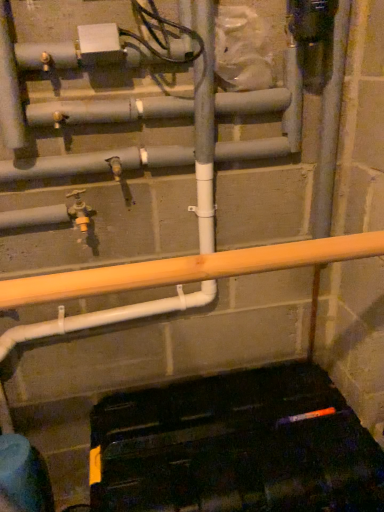
What do you see at coordinates (188, 269) in the screenshot? I see `orange wood beam at center` at bounding box center [188, 269].

In order to face matte yellow valve at center-left, should I rotate leftwards or rightwards?

You should rotate left by 14.425 degrees.

I want to click on gray matte pipe at center, acting as the 1th pipe starting from the bottom, so click(98, 162).

Is matte yellow valve at center-left to the left or to the right of orange wood beam at center in the image?

Clearly, matte yellow valve at center-left is on the left of orange wood beam at center in the image.

Which of these two, matte yellow valve at center-left or orange wood beam at center, is smaller?

Smaller between the two is matte yellow valve at center-left.

From a real-world perspective, is matte yellow valve at center-left below orange wood beam at center?

No, from a real-world perspective, matte yellow valve at center-left is not below orange wood beam at center.

Based on their positions, is orange wood beam at center located to the left or right of gray matte pipe at center?

orange wood beam at center is to the right of gray matte pipe at center.

Is gray matte pipe at center at the back of orange wood beam at center?

No, orange wood beam at center is not facing the opposite direction of gray matte pipe at center.

Based on the photo, is the depth of orange wood beam at center less than that of gray matte pipe at center?

Yes, the depth of orange wood beam at center is less than that of gray matte pipe at center.

Considering the relative sizes of orange wood beam at center and gray matte pipe at center, acting as the second pipe starting from the top, in the image provided, is orange wood beam at center taller than gray matte pipe at center, acting as the second pipe starting from the top,?

No.

Is orange wood beam at center wider or thinner than gray matte pipe at center, acting as the 1th pipe starting from the bottom?

orange wood beam at center is wider than gray matte pipe at center, acting as the 1th pipe starting from the bottom.

Does orange wood beam at center have a smaller size compared to gray matte pipe at center, acting as the second pipe starting from the top?

No, orange wood beam at center is not smaller than gray matte pipe at center, acting as the second pipe starting from the top.

From the image's perspective, is orange wood beam at center beneath gray matte pipe at center, acting as the 1th pipe starting from the bottom?

Correct, orange wood beam at center appears lower than gray matte pipe at center, acting as the 1th pipe starting from the bottom, in the image.

Which is closer to the camera, (200, 231) or (9, 168)?

Point (9, 168)

Which is more to the left, gray matte pipe at center or gray matte pipe at center, acting as the second pipe starting from the top?

gray matte pipe at center, acting as the second pipe starting from the top, is more to the left.

How different are the orientations of gray matte pipe at center and gray matte pipe at center, acting as the second pipe starting from the top, in degrees?

The angle between the facing direction of gray matte pipe at center and the facing direction of gray matte pipe at center, acting as the second pipe starting from the top, is 0.036 degrees.

Considering their positions, is gray matte pipe at center located in front of or behind gray matte pipe at center, acting as the second pipe starting from the top?

Visually, gray matte pipe at center is located in front of gray matte pipe at center, acting as the second pipe starting from the top.

What's the angular difference between orange wood beam at center and matte gray pipe at upper center, arranged as the 1th pipe when viewed from the top,'s facing directions?

There is a 0.981-degree angle between the facing directions of orange wood beam at center and matte gray pipe at upper center, arranged as the 1th pipe when viewed from the top.

Can you see orange wood beam at center touching matte gray pipe at upper center, arranged as the 1th pipe when viewed from the top?

orange wood beam at center and matte gray pipe at upper center, arranged as the 1th pipe when viewed from the top, are not in contact.

Can you confirm if orange wood beam at center is positioned to the left of matte gray pipe at upper center, the 2th pipe when ordered from bottom to top?

No, orange wood beam at center is not to the left of matte gray pipe at upper center, the 2th pipe when ordered from bottom to top.

Locate an element on the screen. beam directly beneath the matte gray pipe at upper center, the 2th pipe when ordered from bottom to top (from a real-world perspective) is located at coordinates (188, 269).

Between gray matte pipe at center, acting as the 1th pipe starting from the bottom, and orange wood beam at center, which one appears on the right side from the viewer's perspective?

orange wood beam at center is more to the right.

You are a GUI agent. You are given a task and a screenshot of the screen. Output one action in this format:
    pyautogui.click(x=<x>, y=<y>)
    Task: Click on the 2nd pipe behind the orange wood beam at center, counting from the anchor's position
    
    Given the screenshot: What is the action you would take?
    pyautogui.click(x=98, y=162)

Considering the points (101, 164) and (353, 236), which point is in front, point (101, 164) or point (353, 236)?

The point (353, 236) is closer.

Considering the points (102, 164) and (78, 216), which point is behind, point (102, 164) or point (78, 216)?

The point (78, 216) is farther from the camera.

Which object is positioned more to the right, gray matte pipe at center, acting as the second pipe starting from the top, or matte yellow valve at center-left?

Positioned to the right is gray matte pipe at center, acting as the second pipe starting from the top.

This screenshot has height=512, width=384. I want to click on plumbing fixture on the left of gray matte pipe at center, acting as the 1th pipe starting from the bottom, so click(79, 210).

Are gray matte pipe at center, acting as the second pipe starting from the top, and matte yellow valve at center-left making contact?

No, gray matte pipe at center, acting as the second pipe starting from the top, is not in contact with matte yellow valve at center-left.

I want to click on beam in front of the matte yellow valve at center-left, so click(x=188, y=269).

Where is `pole above the orange wood beam at center (from the image's perspective)`? pole above the orange wood beam at center (from the image's perspective) is located at coordinates (205, 125).

From the picture: Estimate the real-world distances between objects in this image. Which object is closer to gray matte pipe at center, acting as the second pipe starting from the top, orange wood beam at center or matte yellow valve at center-left?

matte yellow valve at center-left lies closer to gray matte pipe at center, acting as the second pipe starting from the top, than the other object.

From the image, which object appears to be nearer to orange wood beam at center, gray matte pipe at center, acting as the 1th pipe starting from the bottom, or matte yellow valve at center-left?

gray matte pipe at center, acting as the 1th pipe starting from the bottom, lies closer to orange wood beam at center than the other object.

Which object lies further to the anchor point matte yellow valve at center-left, gray matte pipe at center, acting as the 1th pipe starting from the bottom, or matte gray pipe at upper center, arranged as the 1th pipe when viewed from the top?

matte gray pipe at upper center, arranged as the 1th pipe when viewed from the top, lies further to matte yellow valve at center-left than the other object.

Looking at this image, when comparing their distances from gray matte pipe at center, acting as the second pipe starting from the top, does matte gray pipe at upper center, the 2th pipe when ordered from bottom to top, or gray matte pipe at center seem closer?

matte gray pipe at upper center, the 2th pipe when ordered from bottom to top, lies closer to gray matte pipe at center, acting as the second pipe starting from the top, than the other object.

Considering their positions, is gray matte pipe at center positioned closer to matte gray pipe at upper center, arranged as the 1th pipe when viewed from the top, than gray matte pipe at center, acting as the second pipe starting from the top?

gray matte pipe at center, acting as the second pipe starting from the top, lies closer to matte gray pipe at upper center, arranged as the 1th pipe when viewed from the top, than the other object.

Based on the photo, when comparing their distances from matte gray pipe at upper center, arranged as the 1th pipe when viewed from the top, does orange wood beam at center or gray matte pipe at center, acting as the second pipe starting from the top, seem further?

The object further to matte gray pipe at upper center, arranged as the 1th pipe when viewed from the top, is orange wood beam at center.

Looking at this image, from the image, which object appears to be farther from gray matte pipe at center, acting as the second pipe starting from the top, matte yellow valve at center-left or gray matte pipe at center?

matte yellow valve at center-left is further to gray matte pipe at center, acting as the second pipe starting from the top.

From the image, which object appears to be nearer to matte yellow valve at center-left, gray matte pipe at center or orange wood beam at center?

Based on the image, gray matte pipe at center appears to be nearer to matte yellow valve at center-left.

Locate an element on the screen. pipe between matte gray pipe at upper center, arranged as the 1th pipe when viewed from the top, and gray matte pipe at center vertically is located at coordinates (98, 162).

Where is `pipe between orange wood beam at center and gray matte pipe at center, acting as the second pipe starting from the top, from front to back`? This screenshot has width=384, height=512. pipe between orange wood beam at center and gray matte pipe at center, acting as the second pipe starting from the top, from front to back is located at coordinates (110, 111).

You are a GUI agent. You are given a task and a screenshot of the screen. Output one action in this format:
    pyautogui.click(x=<x>, y=<y>)
    Task: Click on the pole between matte gray pipe at upper center, arranged as the 1th pipe when viewed from the top, and orange wood beam at center, in the vertical direction
    This screenshot has height=512, width=384.
    Given the screenshot: What is the action you would take?
    pyautogui.click(x=205, y=125)

You are a GUI agent. You are given a task and a screenshot of the screen. Output one action in this format:
    pyautogui.click(x=<x>, y=<y>)
    Task: Click on the pole between matte yellow valve at center-left and orange wood beam at center from left to right
    The height and width of the screenshot is (512, 384).
    Given the screenshot: What is the action you would take?
    pyautogui.click(x=205, y=125)